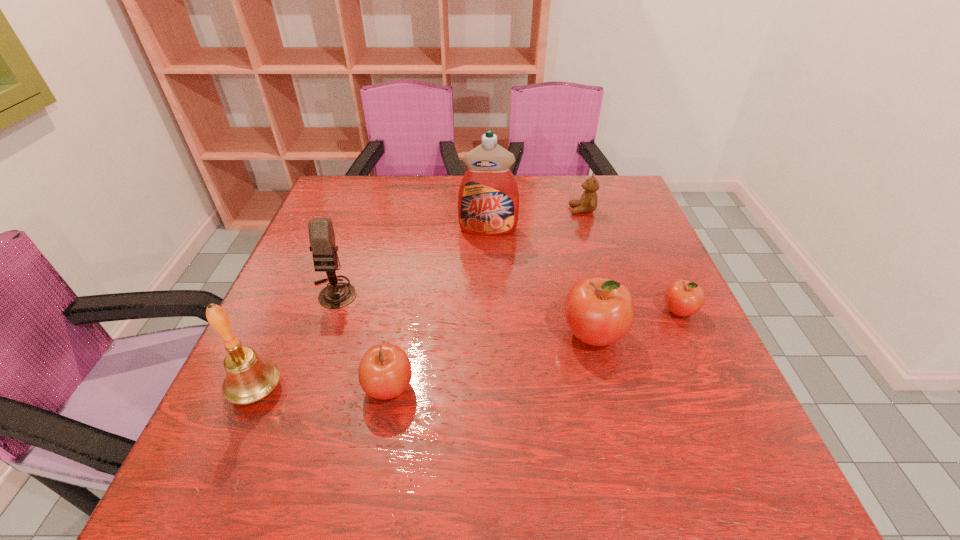
Find the location of a particular element. blank space located on the right of the nearest apple is located at coordinates (457, 388).

The width and height of the screenshot is (960, 540). What are the coordinates of `free spot located on the back of the second apple from left to right` in the screenshot? It's located at (579, 278).

Where is `vacant space located 0.260m on the back of the shortest apple`? The width and height of the screenshot is (960, 540). vacant space located 0.260m on the back of the shortest apple is located at coordinates (642, 231).

Image resolution: width=960 pixels, height=540 pixels. In order to click on blank space located 0.150m on the front surface of the detergent in this screenshot , I will do `click(490, 275)`.

At what (x,y) coordinates should I click in order to perform the action: click on vacant space located on the front-facing side of the microphone. Please return your answer as a coordinate pair (x, y). Looking at the image, I should click on (307, 368).

Find the location of a particular element. vacant space located on the front-facing side of the teddy bear is located at coordinates (431, 210).

Where is `vacant space situated on the front-facing side of the teddy bear`? The height and width of the screenshot is (540, 960). vacant space situated on the front-facing side of the teddy bear is located at coordinates (448, 210).

You are a GUI agent. You are given a task and a screenshot of the screen. Output one action in this format:
    pyautogui.click(x=<x>, y=<y>)
    Task: Click on the blank space located on the front-facing side of the teddy bear
    
    Given the screenshot: What is the action you would take?
    pyautogui.click(x=497, y=210)

You are a GUI agent. You are given a task and a screenshot of the screen. Output one action in this format:
    pyautogui.click(x=<x>, y=<y>)
    Task: Click on the vacant space located 0.230m on the back of the bell
    The height and width of the screenshot is (540, 960).
    Given the screenshot: What is the action you would take?
    pyautogui.click(x=301, y=287)

Locate an element on the screen. Image resolution: width=960 pixels, height=540 pixels. object located in the far edge section of the desktop is located at coordinates (588, 203).